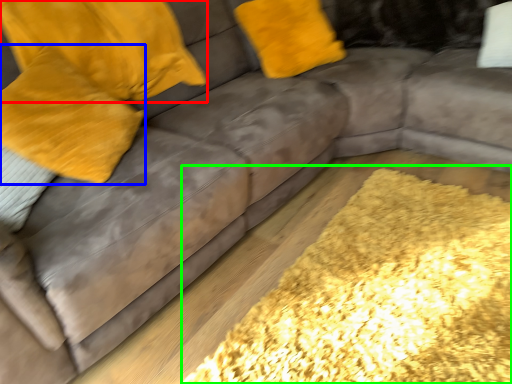
Question: Estimate the real-world distances between objects in this image. Which object is closer to pillow (highlighted by a red box), pillow (highlighted by a blue box) or mat (highlighted by a green box)?

Choices:
 (A) pillow
 (B) mat

Answer: (A)